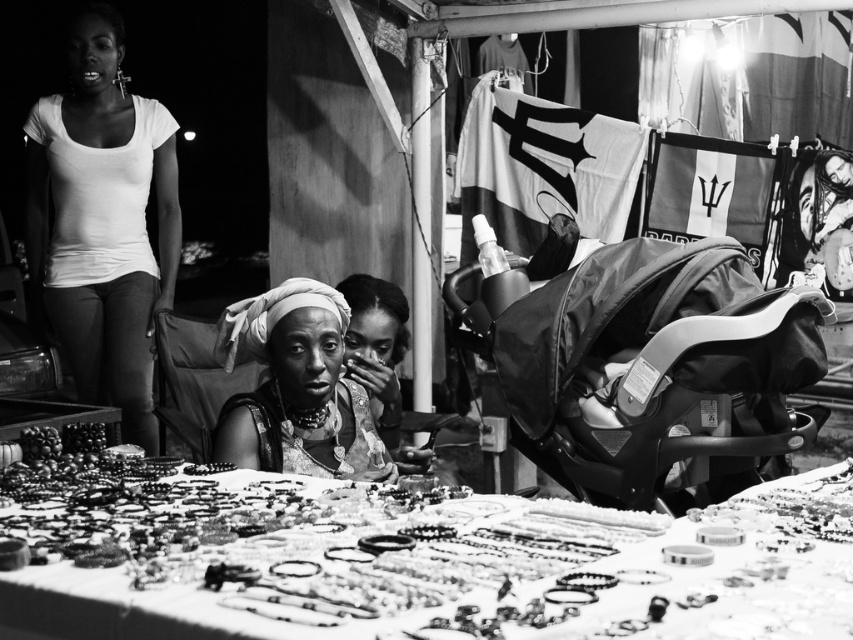
Question: Which of the following is the farthest from the observer?

Choices:
 (A) white matte t-shirt at upper left
 (B) matte black baby carriage at right
 (C) matte fabric headscarf at center
 (D) matte gold necklace at center

Answer: (A)

Question: Which point appears closest to the camera in this image?

Choices:
 (A) (263, 577)
 (B) (68, 74)
 (C) (695, 326)

Answer: (A)

Question: Is white matte t-shirt at upper left positioned at the back of matte gold necklace at center?

Choices:
 (A) no
 (B) yes

Answer: (B)

Question: Can you confirm if metallic jewelry at center is wider than white matte t-shirt at upper left?

Choices:
 (A) no
 (B) yes

Answer: (B)

Question: Is matte black baby carriage at right wider than matte fabric headscarf at center?

Choices:
 (A) yes
 (B) no

Answer: (A)

Question: Which point appears closest to the camera in this image?

Choices:
 (A) (97, 136)
 (B) (192, 540)
 (C) (227, 340)

Answer: (B)